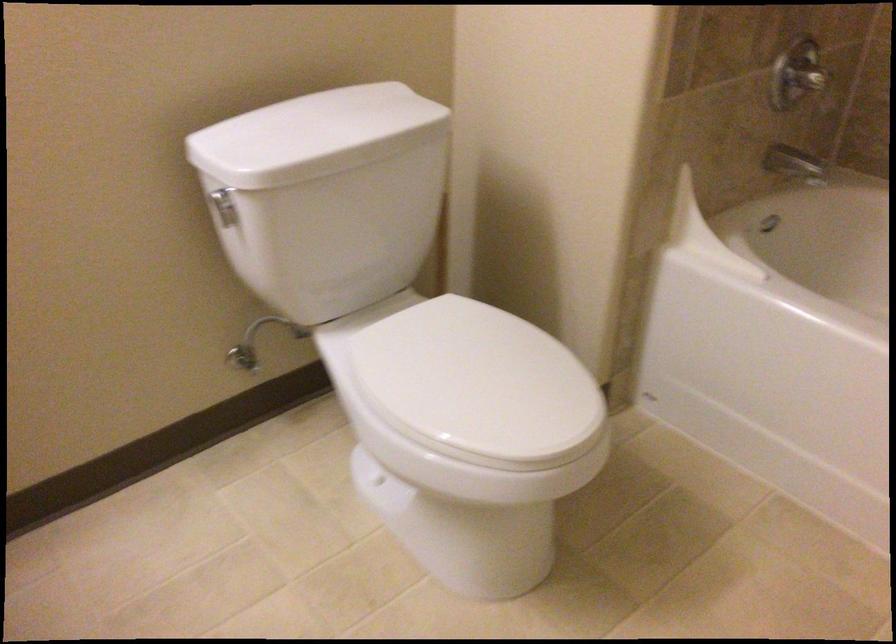
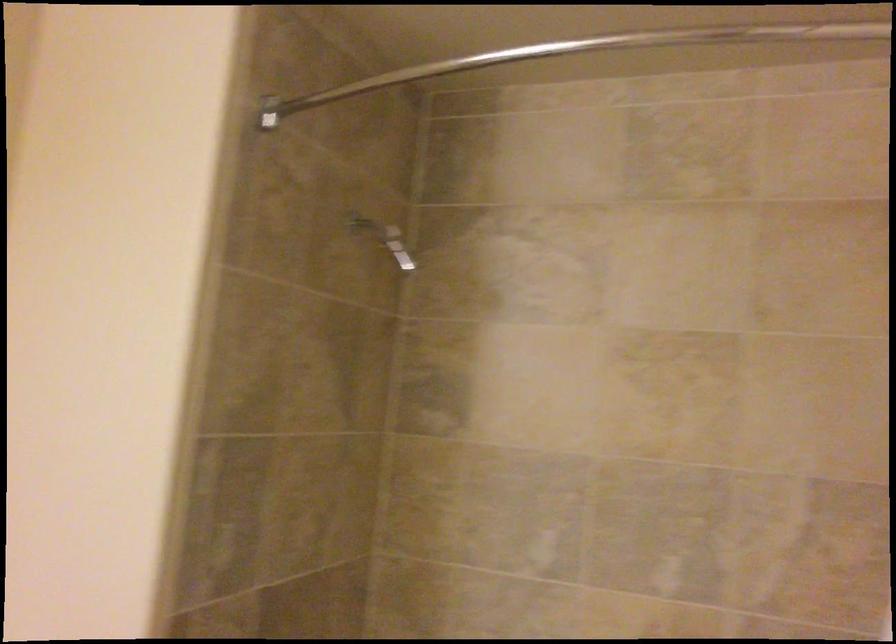
Based on the continuous images, in which direction is the camera rotating?

The camera's rotation is toward right-up.